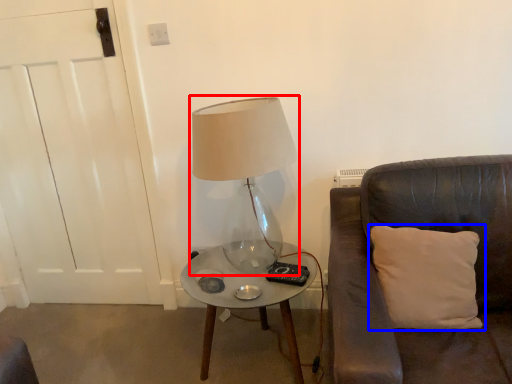
Question: Which of the following is the farthest to the observer, lamp (highlighted by a red box) or pillow (highlighted by a blue box)?

Choices:
 (A) lamp
 (B) pillow

Answer: (A)